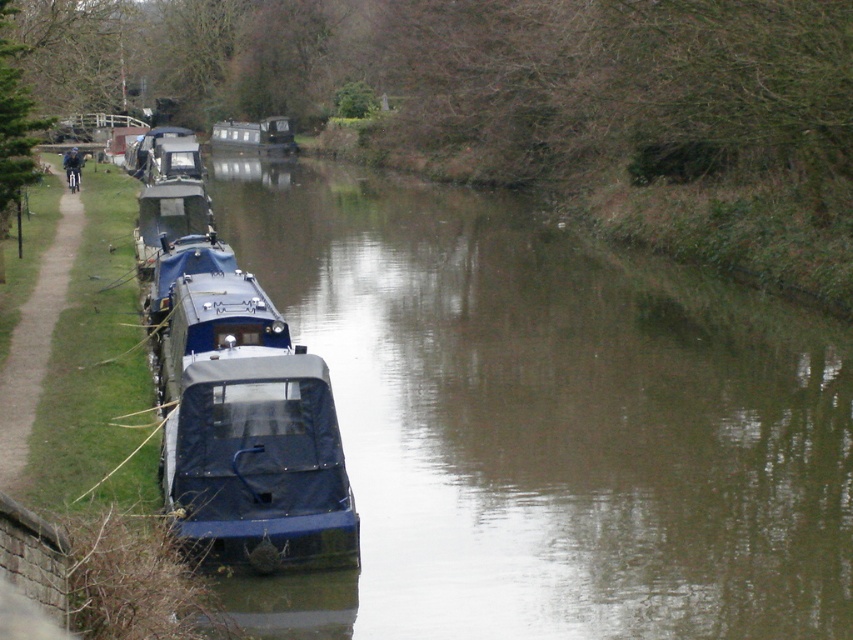
You are standing at the point labeled as point (247, 125) and want to reach the point labeled as point (683, 602). Which direction should you move to get closer to your destination?

You should move forward because point (683, 602) is in front of point (247, 125).

You are standing on the grassy path next to the canal and see the blue rubber boat at left. If you want to reach the boat, which direction should you walk towards?

Since the blue rubber boat at left is located at point (547,422), you should walk towards the left side of the canal to reach it.